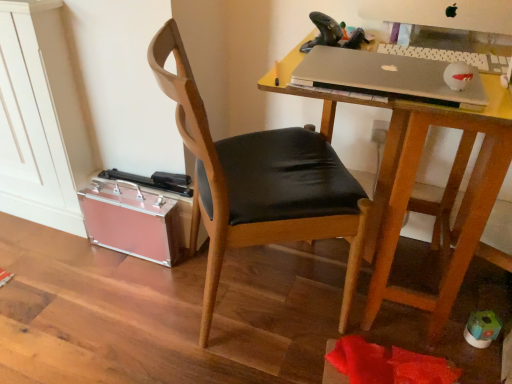
Image resolution: width=512 pixels, height=384 pixels. Identify the location of vacant space positioned to the left of wooden chair at center. (122, 315).